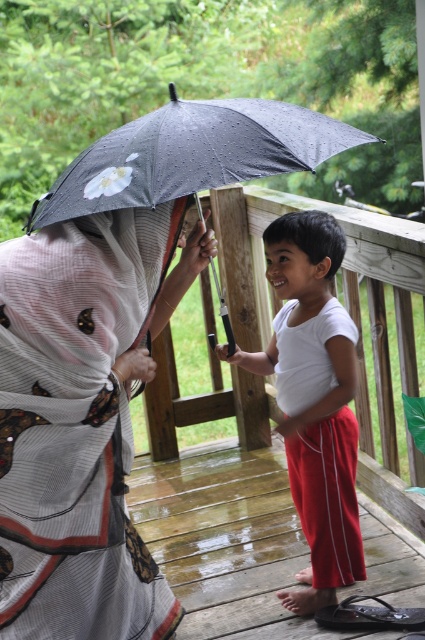
Can you confirm if wet wooden deck at lower center is positioned to the left of black dotted umbrella at center?

No, wet wooden deck at lower center is not to the left of black dotted umbrella at center.

Can you confirm if wet wooden deck at lower center is taller than black dotted umbrella at center?

Correct, wet wooden deck at lower center is much taller as black dotted umbrella at center.

Describe the element at coordinates (226, 540) in the screenshot. The image size is (425, 640). I see `wet wooden deck at lower center` at that location.

This screenshot has height=640, width=425. In order to click on wet wooden deck at lower center in this screenshot , I will do `click(226, 540)`.

Is point (96, 508) behind point (348, 369)?

No, it is not.

Which is below, matte gray scarf at upper left or white cotton shirt at center?

Positioned lower is white cotton shirt at center.

Is point (164, 230) less distant than point (329, 577)?

That is True.

In order to click on matte gray scarf at upper left in this screenshot , I will do `click(82, 420)`.

Can you confirm if matte gray scarf at upper left is bigger than black dotted umbrella at center?

Yes.

How distant is matte gray scarf at upper left from black dotted umbrella at center?

matte gray scarf at upper left and black dotted umbrella at center are 21.76 inches apart from each other.

The height and width of the screenshot is (640, 425). Find the location of `matte gray scarf at upper left`. matte gray scarf at upper left is located at coordinates (82, 420).